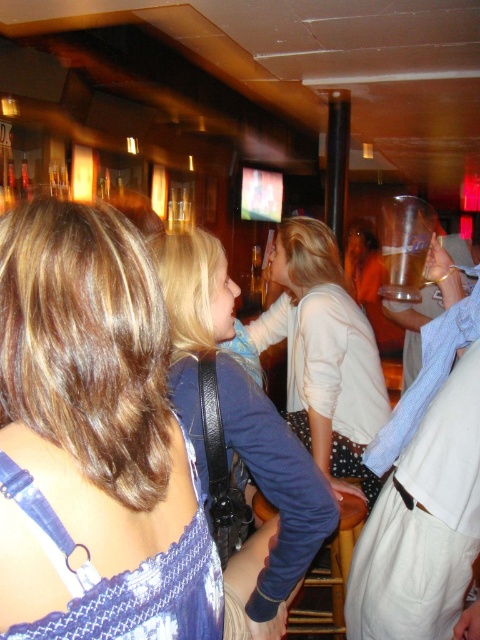
You are a bartender in a busy bar and need to place both the blue denim shirt at center and the clear plastic cup at center on a shelf. The shelf can only hold items where the smaller one is placed below the larger one. Which object should you place on the bottom shelf?

The blue denim shirt at center is smaller than the clear plastic cup at center, so you should place the blue denim shirt at center on the bottom shelf to ensure the larger clear plastic cup at center is placed above it.

You are a photographer trying to capture the scene. You notice the blue fabric dress at upper left and the blue denim shirt at center. Which one would you focus on if you want to photograph something that is thinner?

The blue fabric dress at upper left is thinner than the blue denim shirt at center, so you should focus on the blue fabric dress at upper left.